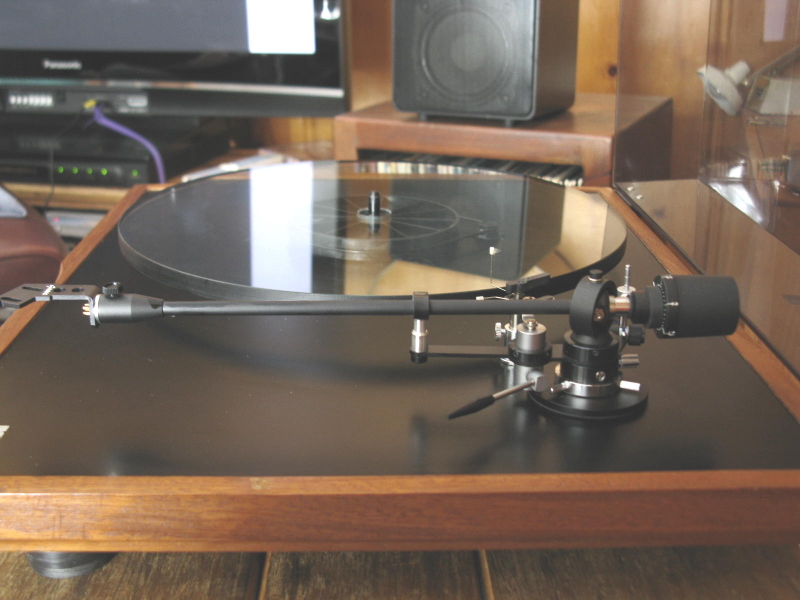
Locate an element on the screen. The width and height of the screenshot is (800, 600). purple cable is located at coordinates (122, 129).